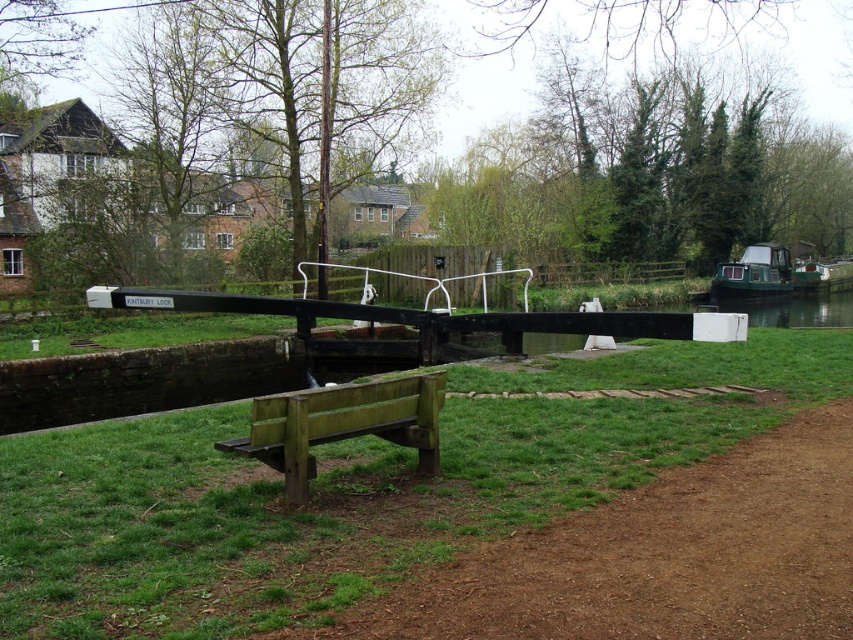
You are a hiker who wants to cross the canal lock. You see the brown dirt path at lower right and the green matte boat at right. Which one is narrower?

The brown dirt path at lower right is smaller in size compared to the green matte boat at right, so the brown dirt path at lower right is narrower.

You are a delivery robot with a width of 1.5 meters. You are positioned at the brown dirt path at lower right and need to reach the green weathered wood bench at lower center. Can you navigate the space between them without moving sideways?

The distance between the brown dirt path at lower right and the green weathered wood bench at lower center is 1.66 meters. Since your width is 1.5 meters, you can navigate the space between them without moving sideways as there is enough clearance.